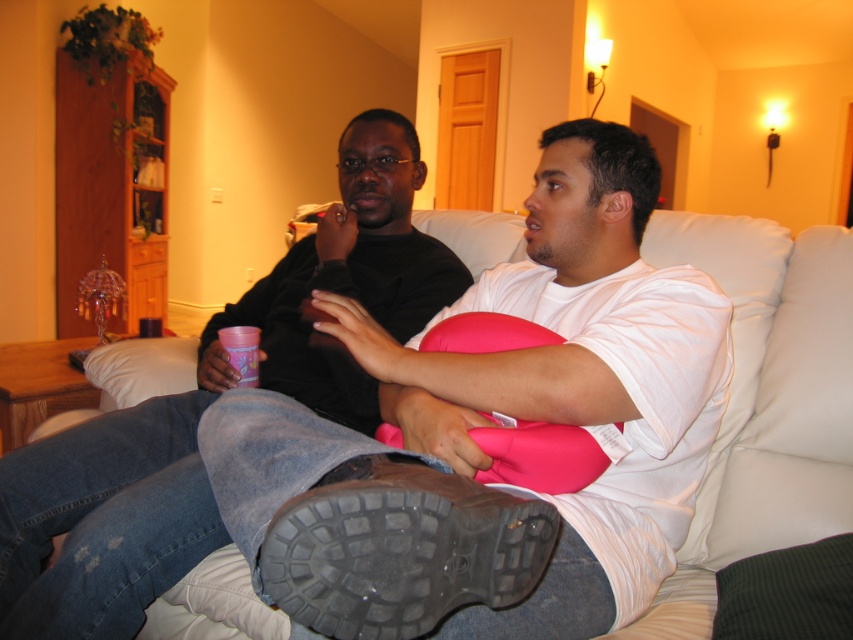
Question: Can you confirm if matte black shirt at center is wider than white leather couch at center?

Choices:
 (A) yes
 (B) no

Answer: (A)

Question: Observing the image, what is the correct spatial positioning of matte black shirt at center in reference to white leather couch at center?

Choices:
 (A) above
 (B) below

Answer: (A)

Question: Can you confirm if matte black shirt at center is positioned below white leather couch at center?

Choices:
 (A) no
 (B) yes

Answer: (A)

Question: Among these objects, which one is farthest from the camera?

Choices:
 (A) matte black shirt at center
 (B) white leather couch at center

Answer: (A)

Question: Which of the following is the closest to the observer?

Choices:
 (A) (833, 508)
 (B) (276, 275)

Answer: (A)